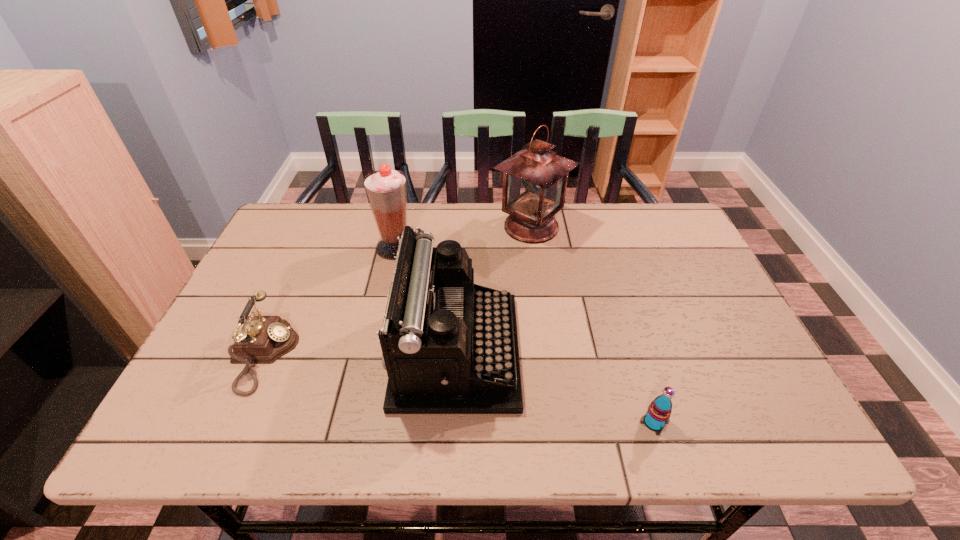
In order to click on vacant space in between the telephone and the smoothie in this screenshot , I will do `click(330, 301)`.

Identify the location of unoccupied area between the soda and the typewriter. The image size is (960, 540). (555, 387).

Find the location of a particular element. unoccupied position between the leftmost object and the smoothie is located at coordinates (330, 301).

Find the location of a particular element. free spot between the soda and the smoothie is located at coordinates (525, 335).

The width and height of the screenshot is (960, 540). Identify the location of free area in between the soda and the typewriter. (555, 387).

The height and width of the screenshot is (540, 960). What are the coordinates of `empty space that is in between the smoothie and the soda` in the screenshot? It's located at (525, 335).

Identify which object is the second closest to the typewriter. Please provide its 2D coordinates. Your answer should be formatted as a tuple, i.e. [(x, y)], where the tuple contains the x and y coordinates of a point satisfying the conditions above.

[(535, 178)]

The height and width of the screenshot is (540, 960). Find the location of `object that is the second closest one to the typewriter`. object that is the second closest one to the typewriter is located at coordinates (535, 178).